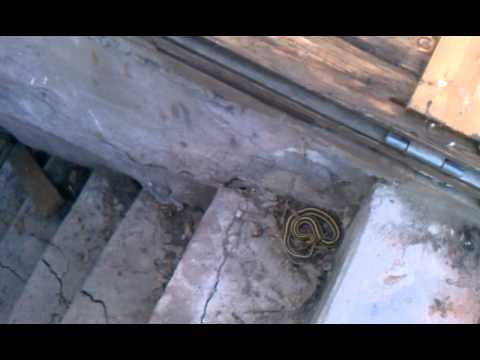
This screenshot has width=480, height=360. What are the coordinates of `hinge` in the screenshot? It's located at (456, 168), (409, 145), (449, 161).